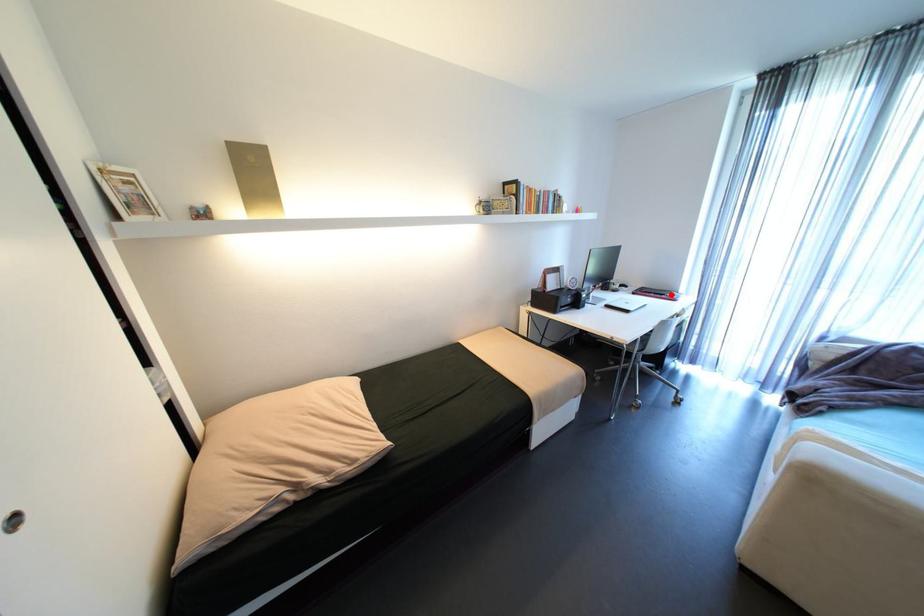
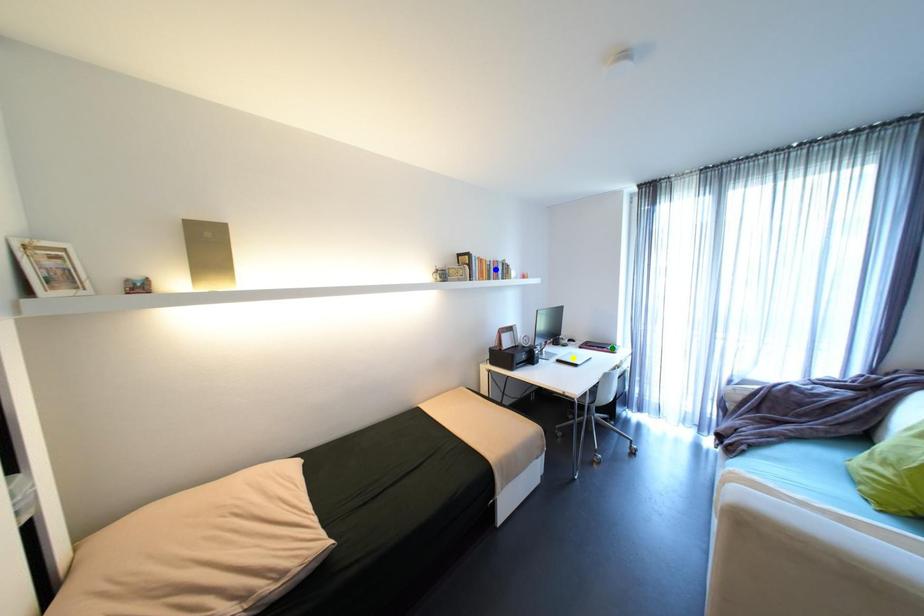
Question: I am providing you with two images of the same scene from different viewpoints. A red point is marked on the first image. You are given multiple points on the second image. Can you choose the point in image 2 that corresponds to the point in image 1?

Choices:
 (A) blue point
 (B) green point
 (C) yellow point

Answer: (B)